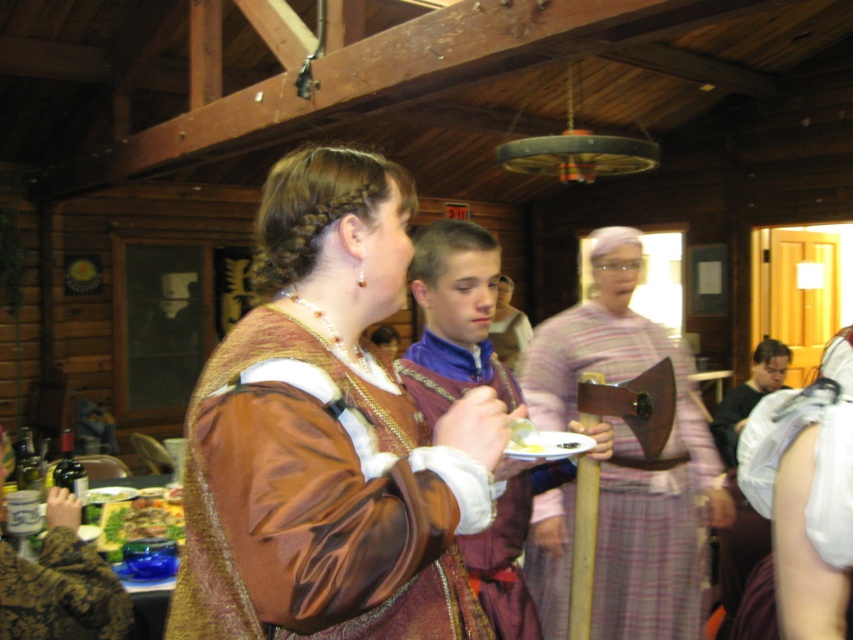
Which is above, green leafy salad at lower left or yellow creamy food at center?

Positioned higher is yellow creamy food at center.

Does point (109, 529) come behind point (515, 426)?

Yes, point (109, 529) is farther from viewer.

Where is `green leafy salad at lower left`? The height and width of the screenshot is (640, 853). green leafy salad at lower left is located at coordinates (138, 522).

Can you confirm if green leafy salad at lower left is smaller than purple satin shirt at center?

Indeed, green leafy salad at lower left has a smaller size compared to purple satin shirt at center.

Between green leafy salad at lower left and purple satin shirt at center, which one is positioned higher?

purple satin shirt at center

Is point (155, 532) positioned behind point (498, 294)?

No, (155, 532) is closer to viewer.

What are the coordinates of `green leafy salad at lower left` in the screenshot? It's located at (138, 522).

Between point (780, 355) and point (526, 339), which one is positioned in front?

Point (780, 355) is in front.

Does point (787, 362) lie behind point (518, 330)?

Yes, point (787, 362) is behind point (518, 330).

Is point (770, 387) positioned in front of point (515, 310)?

Yes, point (770, 387) is closer to viewer.

The width and height of the screenshot is (853, 640). Identify the location of dark green fabric shirt at right. (747, 396).